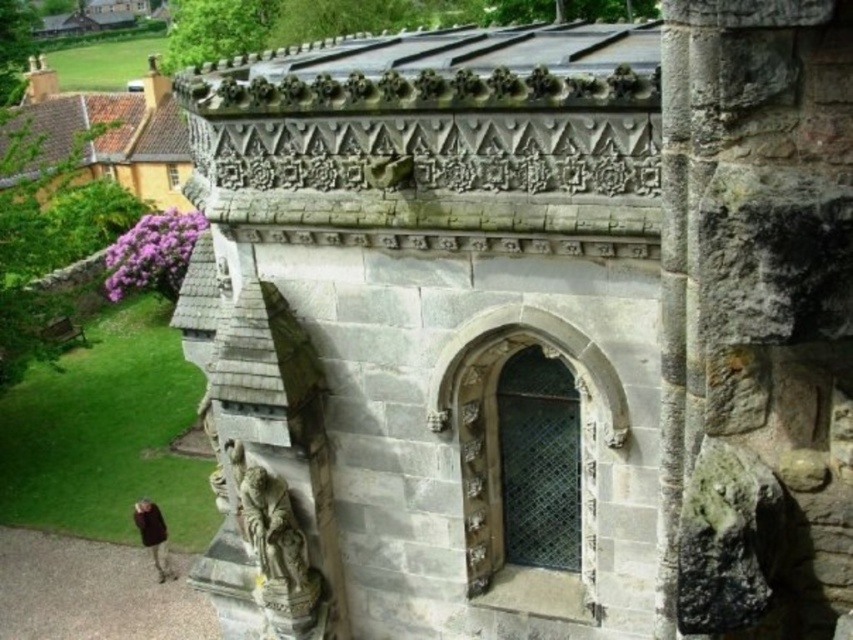
You are standing in front of a historic stone structure. There is a point marked at coordinates point [706,506]. If you want to touch this point with a 5 meter long stick, can you reach it?

The point [706,506] is 5.20 meters away from you, so the 5 meter long stick is not long enough to reach it.

You are standing in front of the historic stone structure and want to take a photo. There are two points marked on the structure. The first point is at coordinates point (827, 173) and the second is at point (160, 573). Which point will appear larger in your photo?

Point (827, 173) is closer to the camera than point (160, 573), so it will appear larger in the photo.